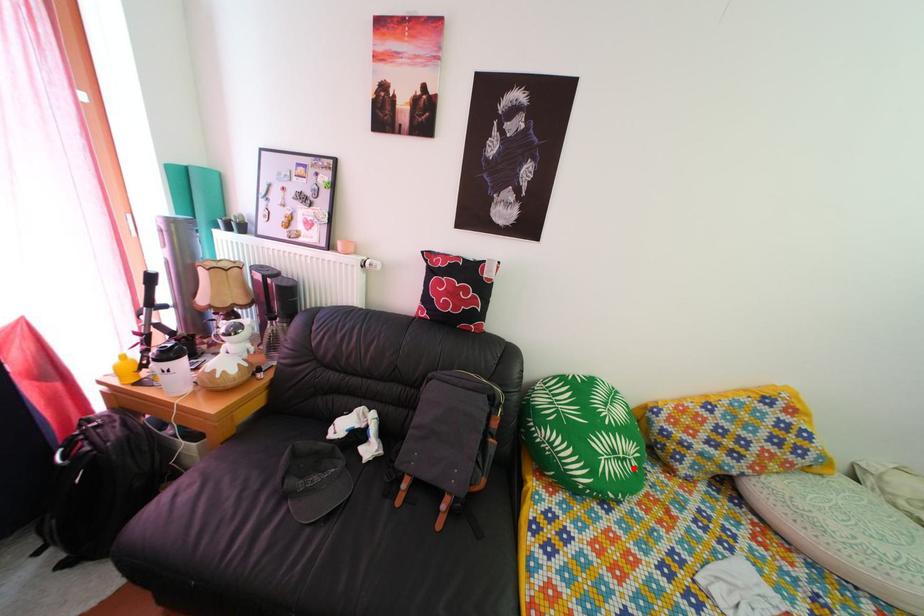
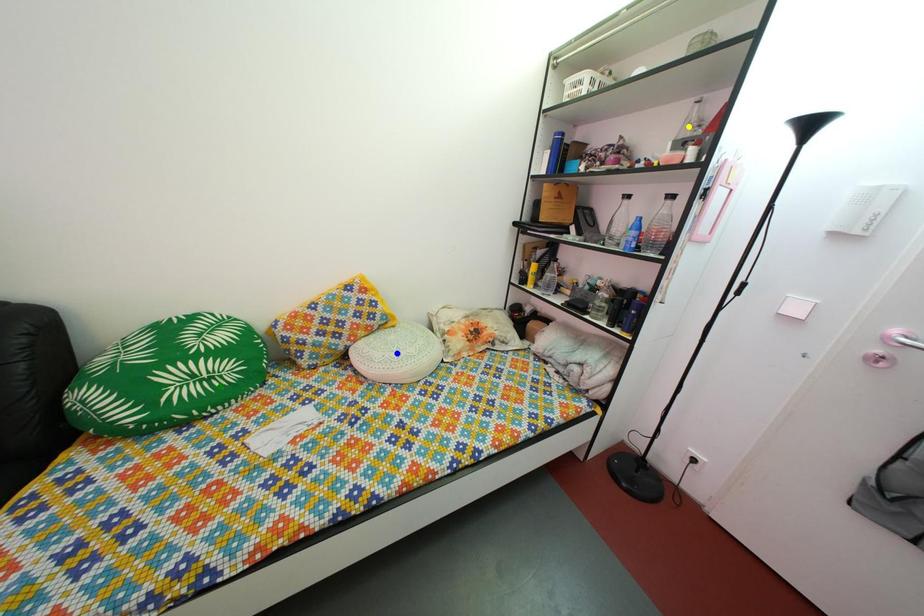
Question: I am providing you with two images of the same scene from different viewpoints. A red point is marked on the first image. You are given multiple points on the second image. Which point in image 2 is actually the same real-world point as the red point in image 1?

Choices:
 (A) yellow point
 (B) blue point
 (C) green point

Answer: (C)